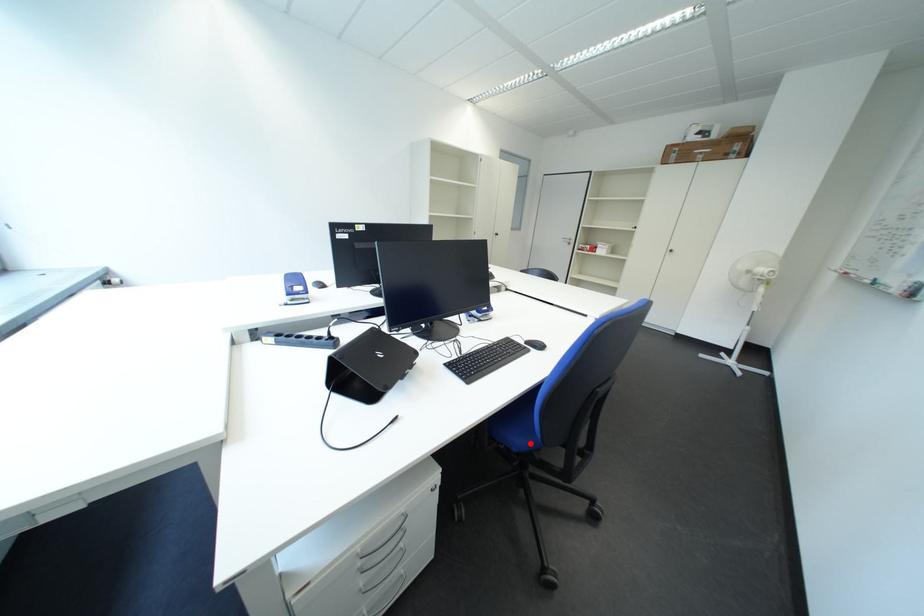
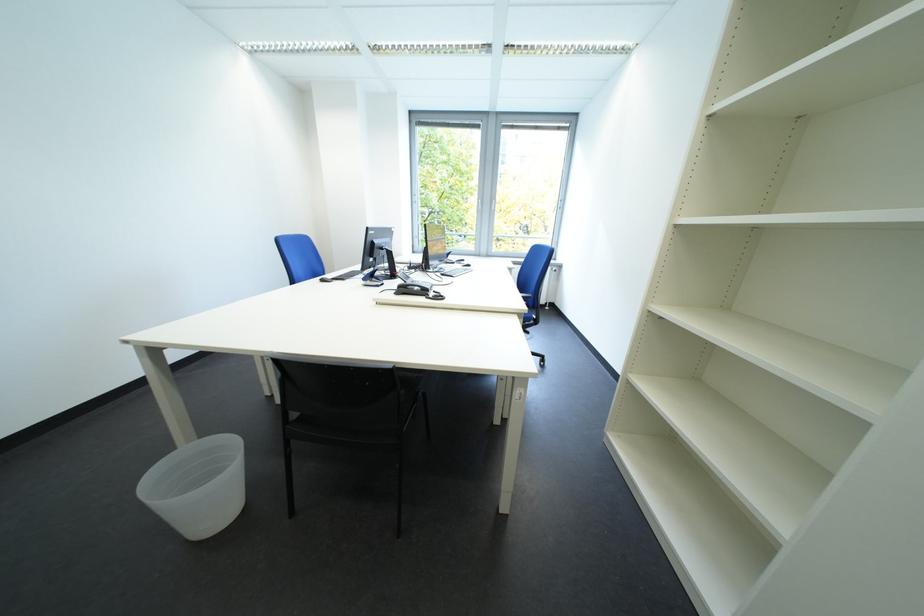
Question: I am providing you with two images of the same scene from different viewpoints. A red point is marked on the first image. Is the red point's position out of view in image 2?

Choices:
 (A) Yes
 (B) No

Answer: (A)